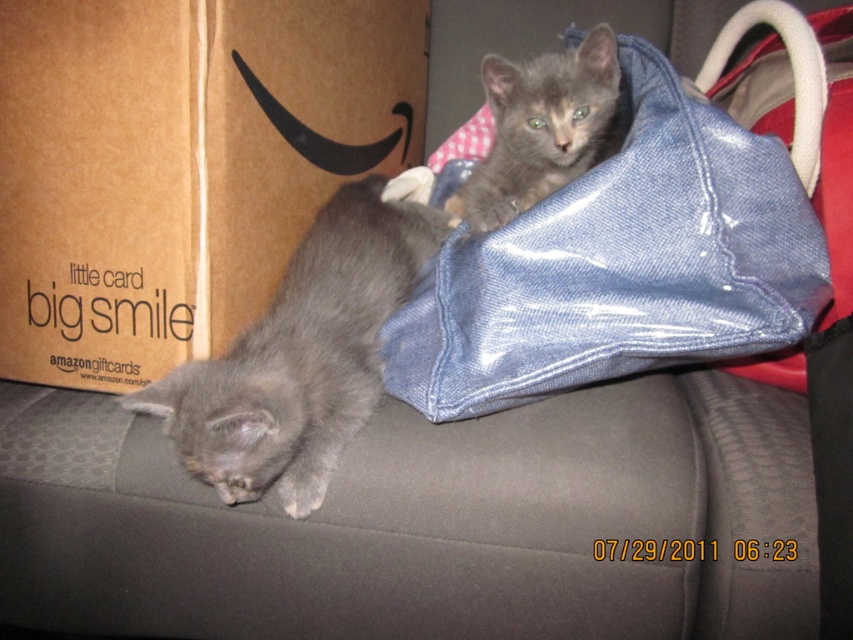
You are a cat owner who wants to put your gray furry kitten at upper right into a carrier. You have a carrier that is the same size as the denim bag at upper right. Will the carrier be big enough?

The denim bag at upper right is much taller than the gray furry kitten at upper right, so the carrier will be big enough to accommodate the gray furry kitten at upper right.

In the scene shown: You are a photographer trying to capture a closeup of the gray furry kitten at upper right. The denim bag at upper right is blocking your view. Can you move the bag to get a clear shot?

The denim bag at upper right is below the gray furry kitten at upper right, so moving the bag would allow you to see the kitten clearly.